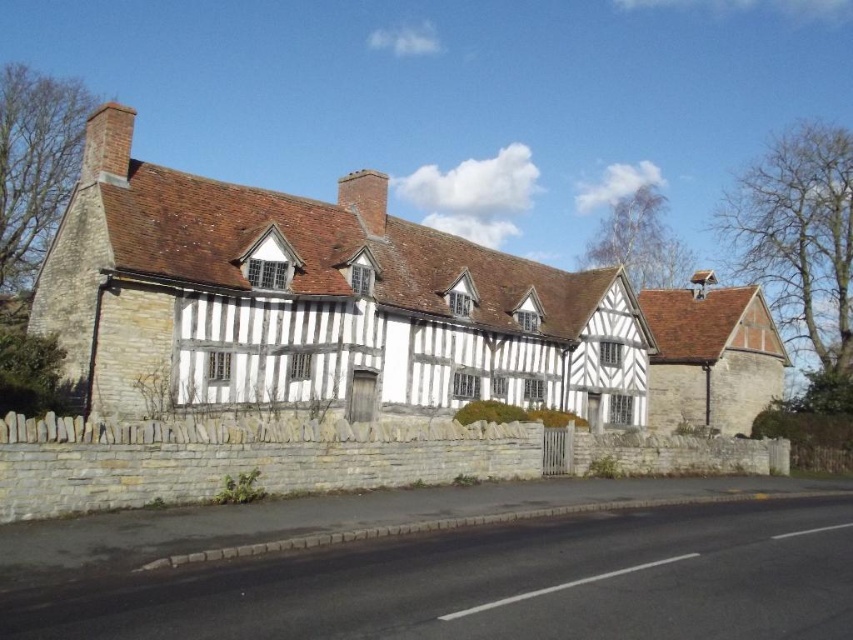
You are standing at the center of the road and see the white timber framed house at center. Where exactly is the white timber framed house at center located in relation to the point marked at coordinates (315, 301)?

The white timber framed house at center is located exactly at the point marked at coordinates (315, 301).